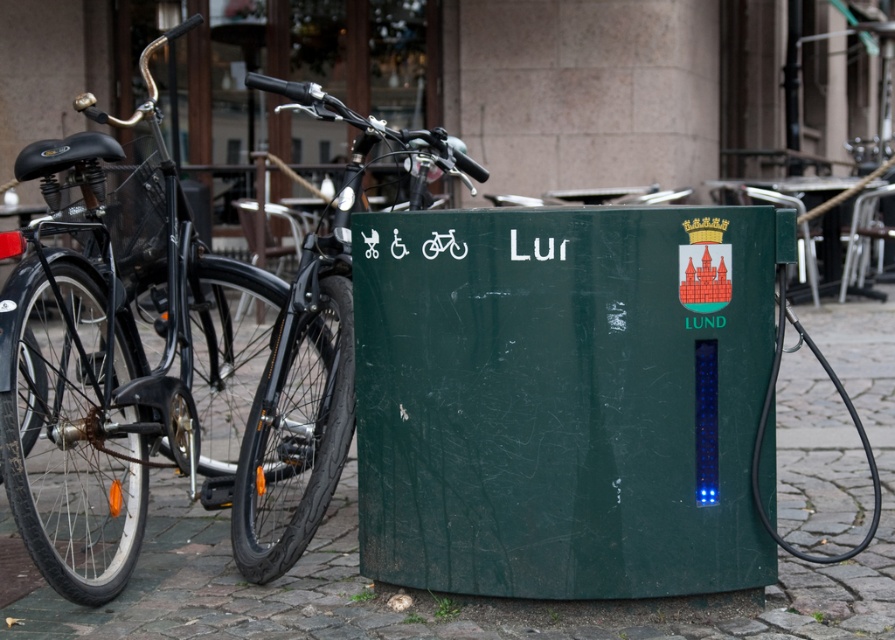
Which is in front, point (484, 525) or point (69, 412)?

Point (484, 525)

Image resolution: width=895 pixels, height=640 pixels. I want to click on green matte recycling bin at center, so click(x=564, y=397).

Locate an element on the screen. This screenshot has width=895, height=640. green matte recycling bin at center is located at coordinates (564, 397).

Which of these two, green matte recycling bin at center or shiny black bicycle at center, stands taller?

shiny black bicycle at center

Who is more distant from viewer, (493, 364) or (418, 131)?

Point (418, 131)

Identify the location of green matte recycling bin at center. (564, 397).

Is black matte bicycle at left below shiny black bicycle at center?

Yes.

Does black matte bicycle at left appear on the right side of shiny black bicycle at center?

Incorrect, black matte bicycle at left is not on the right side of shiny black bicycle at center.

Which is behind, point (205, 420) or point (413, 141)?

Positioned behind is point (205, 420).

Find the location of a particular element. This screenshot has width=895, height=640. black matte bicycle at left is located at coordinates (148, 360).